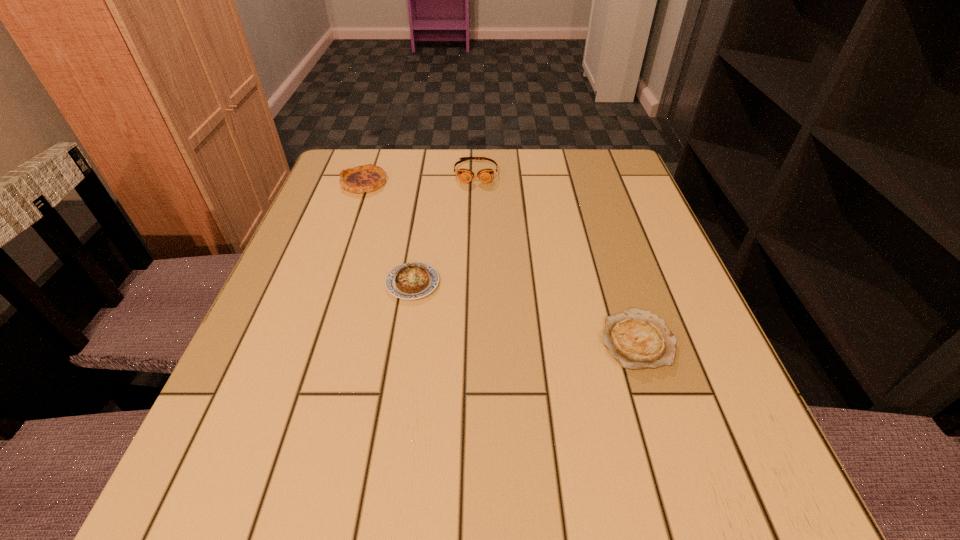
What are the coordinates of `free spot located on the front of the second nearest quiche` in the screenshot? It's located at (396, 394).

The image size is (960, 540). I want to click on vacant space located 0.120m on the front of the nearest object, so click(670, 446).

Identify the location of goggles present at the far edge. (485, 175).

At what (x,y) coordinates should I click in order to perform the action: click on quiche present at the far edge. Please return your answer as a coordinate pair (x, y). The width and height of the screenshot is (960, 540). Looking at the image, I should click on (366, 178).

Identify the location of object that is at the left edge. This screenshot has height=540, width=960. (366, 178).

Identify the location of object at the right edge. (637, 339).

Find the location of a particular element. The height and width of the screenshot is (540, 960). object that is at the far left corner is located at coordinates (366, 178).

Identify the location of free location at the far edge. This screenshot has width=960, height=540. (498, 190).

Identify the location of vacant space at the near edge of the desktop. (555, 497).

Where is `free region at the left edge of the desktop`? The height and width of the screenshot is (540, 960). free region at the left edge of the desktop is located at coordinates 249,394.